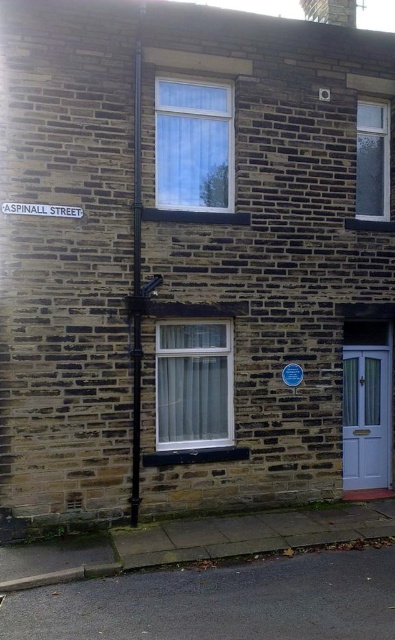
Question: Is white glossy door at lower right below metallic pole at center?

Choices:
 (A) yes
 (B) no

Answer: (A)

Question: Among these objects, which one is nearest to the camera?

Choices:
 (A) metallic pole at center
 (B) white plastic street sign at upper left

Answer: (B)

Question: Which object appears closest to the camera in this image?

Choices:
 (A) white plastic street sign at upper left
 (B) metallic pole at center
 (C) white glossy door at lower right

Answer: (A)

Question: Is metallic pole at center wider than white plastic street sign at upper left?

Choices:
 (A) yes
 (B) no

Answer: (B)

Question: Which object is closer to the camera taking this photo?

Choices:
 (A) white plastic street sign at upper left
 (B) white glossy door at lower right
 (C) metallic pole at center

Answer: (A)

Question: In this image, where is white glossy door at lower right located relative to metallic pole at center?

Choices:
 (A) below
 (B) above

Answer: (A)